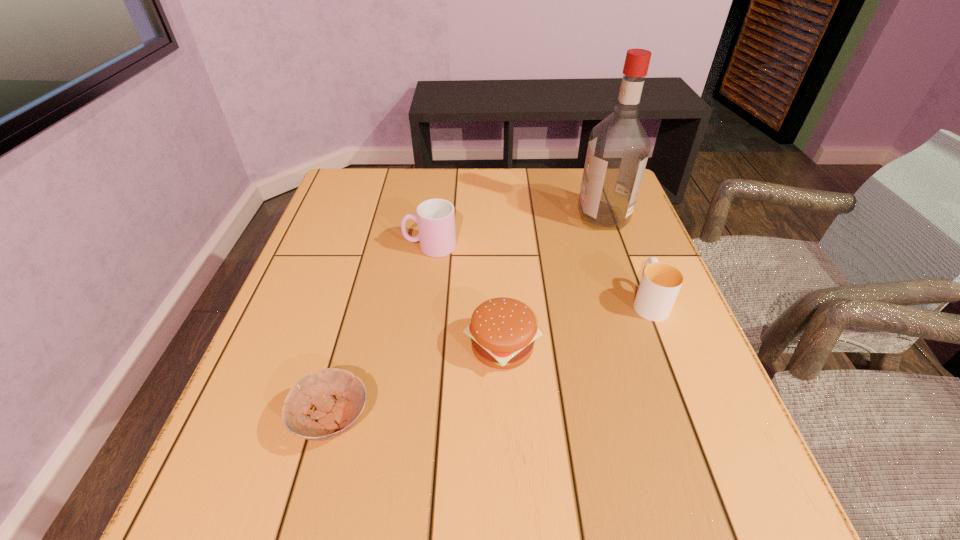
Where is `vacant space that is in between the bowl and the hamburger`? Image resolution: width=960 pixels, height=540 pixels. vacant space that is in between the bowl and the hamburger is located at coordinates (418, 383).

The image size is (960, 540). Identify the location of vacant point located between the nearest object and the hamburger. (418, 383).

Locate an element on the screen. The image size is (960, 540). free space between the tallest object and the right cup is located at coordinates (626, 259).

The width and height of the screenshot is (960, 540). I want to click on free point between the liquor and the fourth nearest object, so click(x=516, y=232).

Locate an element on the screen. The height and width of the screenshot is (540, 960). unoccupied area between the right cup and the third object from right to left is located at coordinates (575, 324).

The width and height of the screenshot is (960, 540). In order to click on free point between the hamburger and the left cup in this screenshot , I will do `click(467, 296)`.

The width and height of the screenshot is (960, 540). I want to click on vacant space that's between the third object from right to left and the shorter cup, so click(x=575, y=324).

Where is `object that is the third closest to the liquor`? The width and height of the screenshot is (960, 540). object that is the third closest to the liquor is located at coordinates (503, 331).

The width and height of the screenshot is (960, 540). I want to click on object that is the nearest to the nearer cup, so click(618, 148).

Find the location of a particular element. The height and width of the screenshot is (540, 960). free space that satisfies the following two spatial constraints: 1. with the handle on the side of the shorter cup; 2. on the front-facing side of the tallest object is located at coordinates (616, 217).